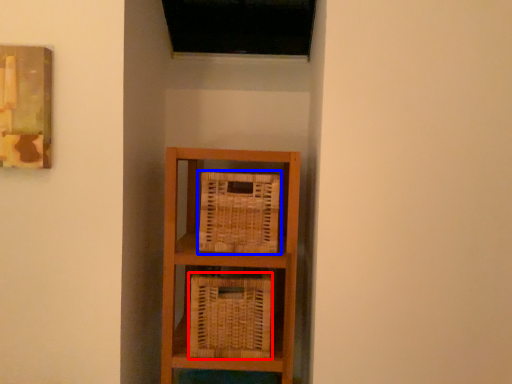
Question: Which object is closer to the camera taking this photo, basket (highlighted by a red box) or basket (highlighted by a blue box)?

Choices:
 (A) basket
 (B) basket

Answer: (A)